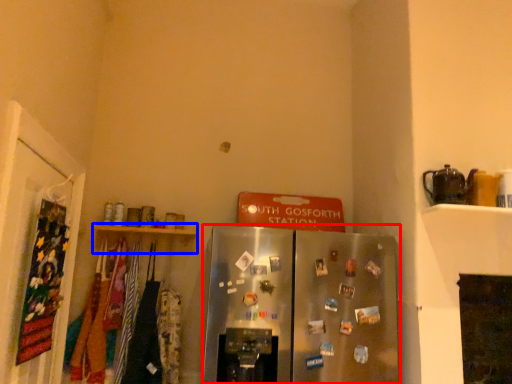
Question: Which point is further to the camera, refrigerator (highlighted by a red box) or shelf (highlighted by a blue box)?

Choices:
 (A) refrigerator
 (B) shelf

Answer: (B)